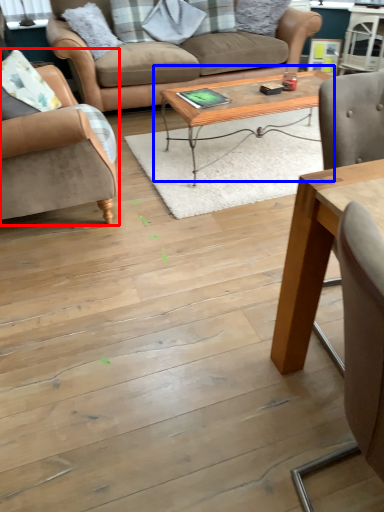
Question: Among these objects, which one is nearest to the camera, chair (highlighted by a red box) or coffee table (highlighted by a blue box)?

Choices:
 (A) chair
 (B) coffee table

Answer: (A)